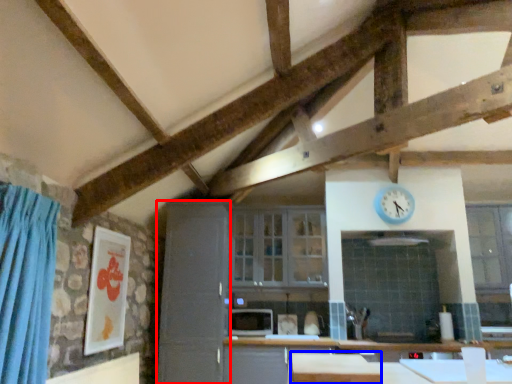
Question: Which of the following is the closest to the observer, cabinetry (highlighted by a red box) or table (highlighted by a blue box)?

Choices:
 (A) cabinetry
 (B) table

Answer: (B)